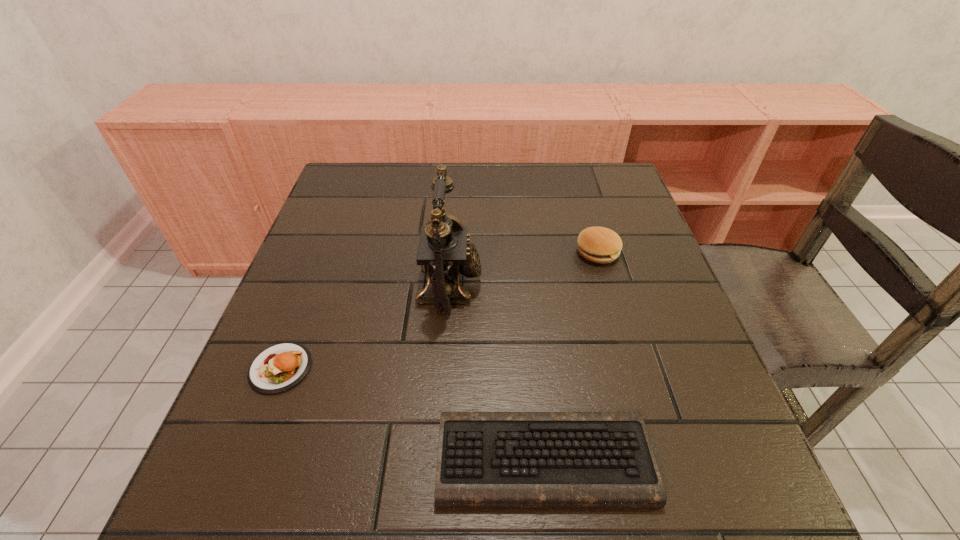
Find the location of a particular element. This screenshot has height=540, width=960. telephone is located at coordinates (443, 252).

The height and width of the screenshot is (540, 960). I want to click on the taller patty (food), so click(x=601, y=245).

Find the location of `the right patty (food)`. the right patty (food) is located at coordinates (601, 245).

Locate an element on the screen. This screenshot has height=540, width=960. the left patty (food) is located at coordinates pos(280,367).

At what (x,y) coordinates should I click in order to perform the action: click on the second nearest object. Please return your answer as a coordinate pair (x, y). The image size is (960, 540). Looking at the image, I should click on (280, 367).

I want to click on computer keyboard, so click(485, 459).

The image size is (960, 540). What are the coordinates of `vacant space positioned on the rotary dial of the telephone` in the screenshot? It's located at (564, 284).

This screenshot has height=540, width=960. What are the coordinates of `vacant area situated 0.340m on the left of the third shortest object` in the screenshot? It's located at (431, 252).

You are a GUI agent. You are given a task and a screenshot of the screen. Output one action in this format:
    pyautogui.click(x=<x>, y=<y>)
    Task: Click on the free space located on the right of the shorter patty (food)
    
    Given the screenshot: What is the action you would take?
    pyautogui.click(x=465, y=368)

You are a GUI agent. You are given a task and a screenshot of the screen. Output one action in this format:
    pyautogui.click(x=<x>, y=<y>)
    Task: Click on the vacant space situated on the left of the nearest object
    
    Given the screenshot: What is the action you would take?
    pyautogui.click(x=246, y=458)